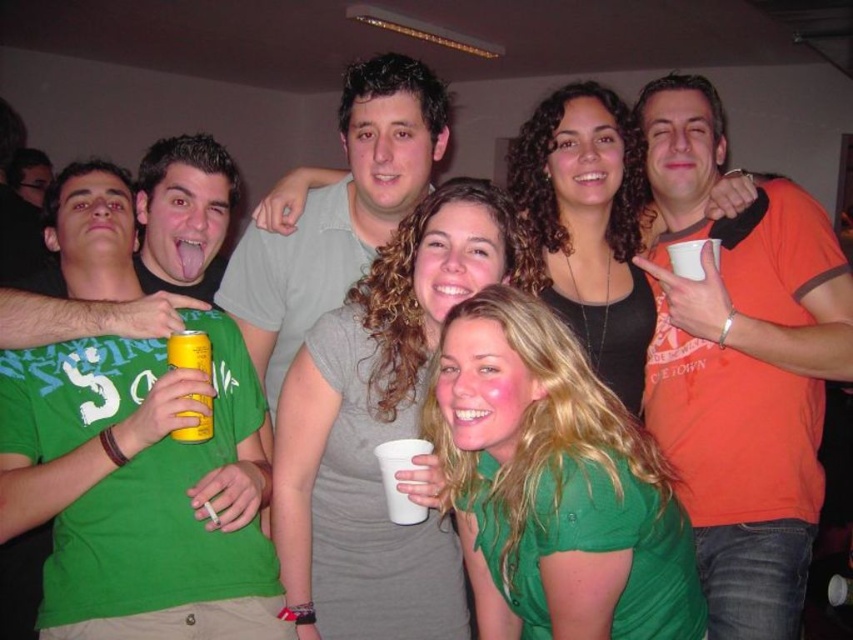
Does gray matte dress at center appear under light gray t-shirt at center?

Correct, gray matte dress at center is located below light gray t-shirt at center.

Can you confirm if gray matte dress at center is bigger than light gray t-shirt at center?

Yes, gray matte dress at center is bigger than light gray t-shirt at center.

Which is in front, point (314, 349) or point (398, 100)?

Point (314, 349) is in front.

At what (x,y) coordinates should I click in order to perform the action: click on gray matte dress at center. Please return your answer as a coordinate pair (x, y). Looking at the image, I should click on (381, 426).

Can you confirm if gray matte dress at center is positioned below green matte shirt at center?

Actually, gray matte dress at center is above green matte shirt at center.

Is gray matte dress at center shorter than green matte shirt at center?

Incorrect, gray matte dress at center's height does not fall short of green matte shirt at center's.

Which is behind, point (335, 506) or point (700, 600)?

Positioned behind is point (335, 506).

Where is `gray matte dress at center`? gray matte dress at center is located at coordinates (381, 426).

Is green matte shirt at center to the right of light gray t-shirt at center from the viewer's perspective?

Indeed, green matte shirt at center is positioned on the right side of light gray t-shirt at center.

Does point (485, 548) lie in front of point (273, 314)?

Yes, it is.

Image resolution: width=853 pixels, height=640 pixels. Describe the element at coordinates (555, 470) in the screenshot. I see `green matte shirt at center` at that location.

The width and height of the screenshot is (853, 640). In order to click on green matte shirt at center in this screenshot , I will do `click(555, 470)`.